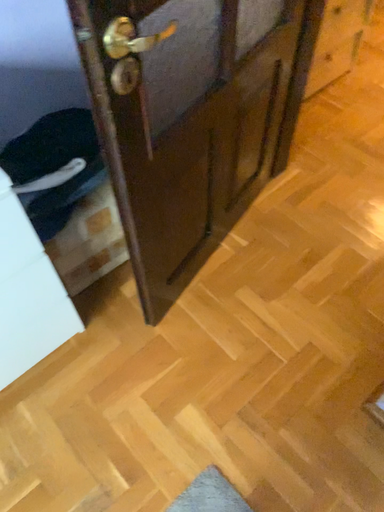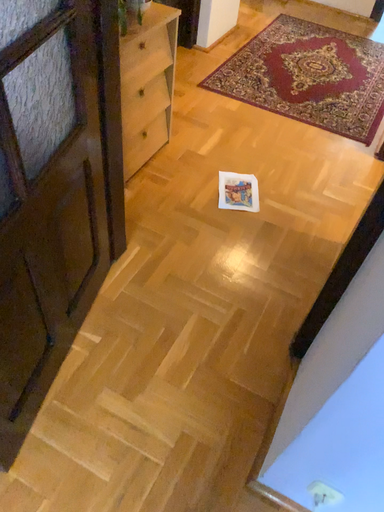
Question: Which way did the camera rotate in the video?

Choices:
 (A) rotated left
 (B) rotated right

Answer: (B)